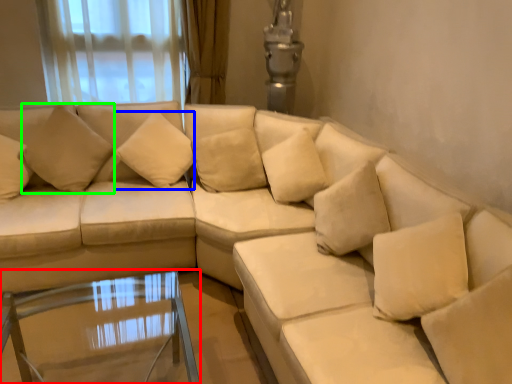
Question: Which is nearer to the table (highlighted by a red box)? pillow (highlighted by a blue box) or pillow (highlighted by a green box).

Choices:
 (A) pillow
 (B) pillow

Answer: (B)